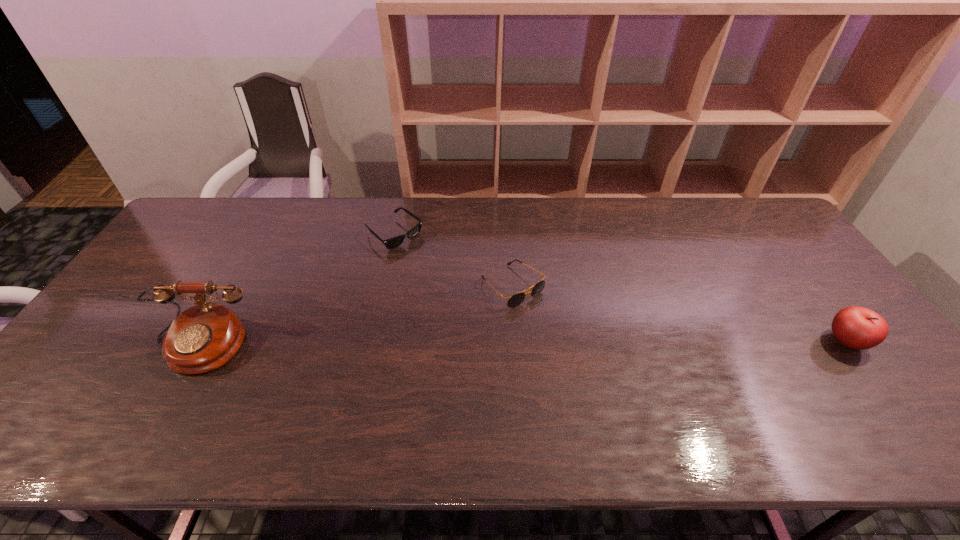
In order to click on free space between the leftmost object and the right sunglasses in this screenshot , I will do `click(356, 316)`.

Where is `unoccupied area between the rightmost object and the right sunglasses`? unoccupied area between the rightmost object and the right sunglasses is located at coordinates (680, 314).

Where is `free point between the third object from right to left and the leftmost object`? free point between the third object from right to left and the leftmost object is located at coordinates (297, 289).

The width and height of the screenshot is (960, 540). I want to click on vacant space that is in between the nearer sunglasses and the telephone, so click(x=356, y=316).

At what (x,y) coordinates should I click in order to perform the action: click on vacant area that lies between the third shortest object and the farther sunglasses. Please return your answer as a coordinate pair (x, y). Looking at the image, I should click on (620, 288).

Choose which object is the third nearest neighbor to the left sunglasses. Please provide its 2D coordinates. Your answer should be formatted as a tuple, i.e. [(x, y)], where the tuple contains the x and y coordinates of a point satisfying the conditions above.

[(859, 328)]

The image size is (960, 540). Find the location of `object that is the second closest to the second object from left to right`. object that is the second closest to the second object from left to right is located at coordinates (204, 337).

The height and width of the screenshot is (540, 960). In order to click on free point that satisfies the following two spatial constraints: 1. on the front side of the second tallest object; 2. on the right side of the left sunglasses in this screenshot , I will do `click(371, 341)`.

Locate an element on the screen. free spot that satisfies the following two spatial constraints: 1. on the front side of the farther sunglasses; 2. on the left side of the rightmost object is located at coordinates (371, 341).

Image resolution: width=960 pixels, height=540 pixels. What are the coordinates of `vacant area that satisfies the following two spatial constraints: 1. on the front side of the third shortest object; 2. on the left side of the third object from left to right` in the screenshot? It's located at (x=516, y=341).